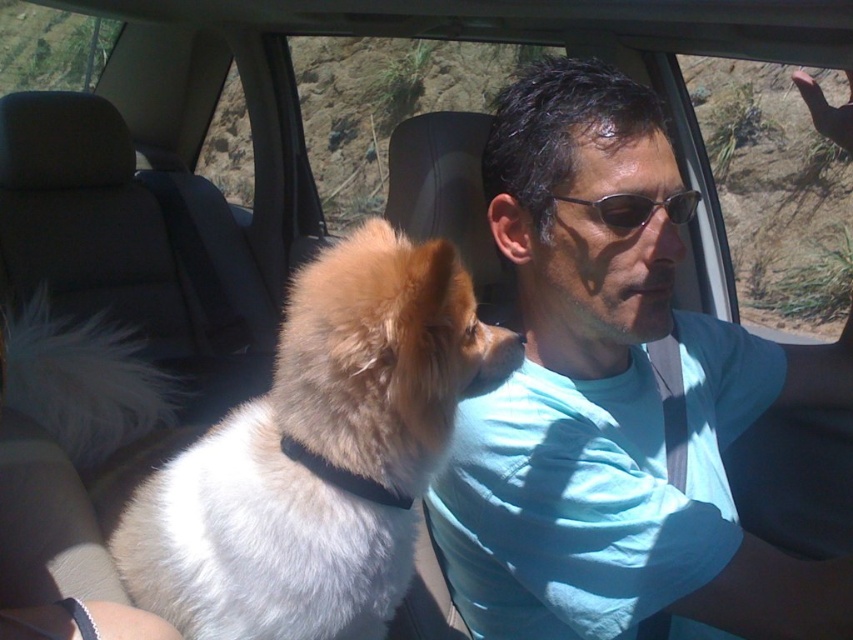
What do you see at coordinates (775, 195) in the screenshot? I see `transparent glass car window at upper right` at bounding box center [775, 195].

Is point (844, 88) positioned in front of point (627, 205)?

No, (844, 88) is behind (627, 205).

Which is behind, point (776, 88) or point (686, 202)?

Point (776, 88)

Identify the location of transparent glass car window at upper right. The height and width of the screenshot is (640, 853). (775, 195).

This screenshot has width=853, height=640. What do you see at coordinates (318, 452) in the screenshot? I see `white fluffy dog at center` at bounding box center [318, 452].

Find the location of `white fluffy dog at center`. white fluffy dog at center is located at coordinates (318, 452).

The width and height of the screenshot is (853, 640). I want to click on white fluffy dog at center, so click(x=318, y=452).

Between white fluffy dog at center and sunglasses at center, which one has more height?

With more height is white fluffy dog at center.

Measure the distance between point (358, 342) and camera.

Point (358, 342) and camera are 31.62 inches apart from each other.

Find the location of a particular element. white fluffy dog at center is located at coordinates (318, 452).